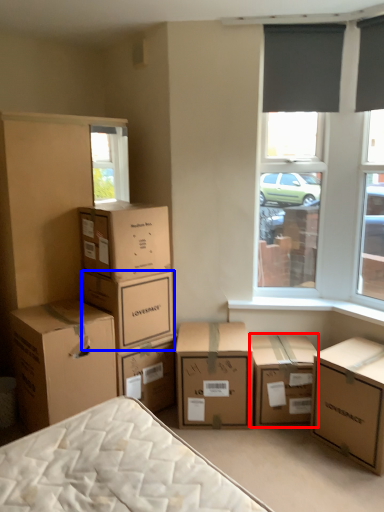
Question: Which object is closer to the camera taking this photo, box (highlighted by a red box) or box (highlighted by a blue box)?

Choices:
 (A) box
 (B) box

Answer: (B)